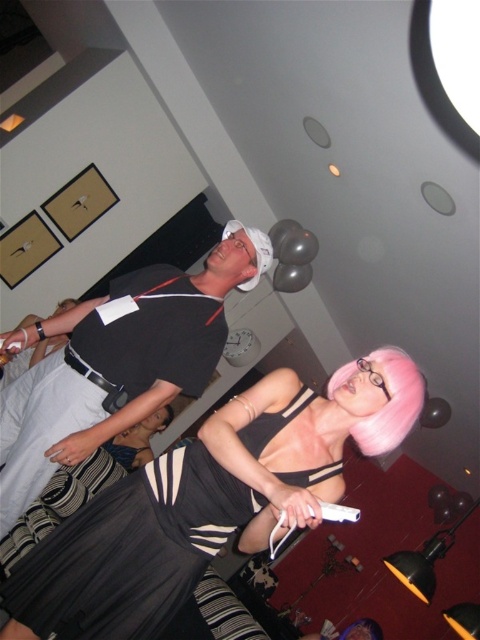
You are at a party and want to grab the white matte wii remote at center to join the game. However, you notice the black matte shirt at upper center is in the way. Can you reach the remote without moving the shirt?

The white matte wii remote at center is behind the black matte shirt at upper center, so you cannot reach it without moving the shirt.

You are a photographer at the party and want to take a photo of the black satin dress at center and the white matte wii remote at center. To ensure both fit in the frame, you need to know which object is wider. Which one is wider?

The black satin dress at center is wider than the white matte wii remote at center.

You are a photographer at a party and need to capture a photo of both the black satin dress at center and the black matte shirt at upper center. The camera you have can focus on objects within a 20 inch range. Can you fit both subjects into the focus range without moving the camera?

The distance between the black satin dress at center and the black matte shirt at upper center is 22.66 inches. Since the camera can only focus on objects within a 20 inch range, the two subjects are slightly out of the focus range. You might need to adjust your position or use a different camera setting to ensure both are in focus.